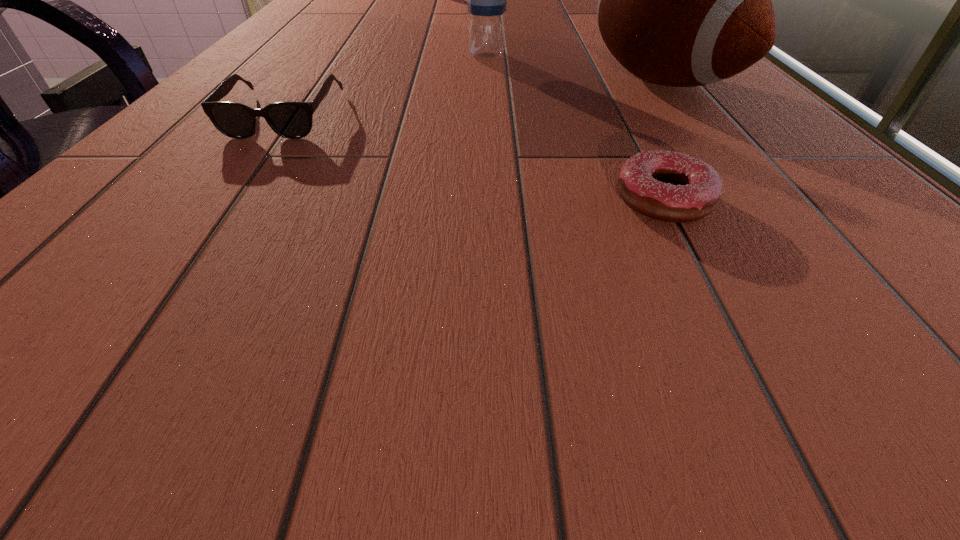
The width and height of the screenshot is (960, 540). In order to click on the third tallest object in this screenshot , I will do `click(293, 120)`.

Locate an element on the screen. The image size is (960, 540). sunglasses is located at coordinates tap(293, 120).

Where is `the shortest object`? This screenshot has width=960, height=540. the shortest object is located at coordinates (668, 186).

You are a GUI agent. You are given a task and a screenshot of the screen. Output one action in this format:
    pyautogui.click(x=<x>, y=<y>)
    Task: Click on the nearest object
    The height and width of the screenshot is (540, 960).
    Given the screenshot: What is the action you would take?
    pyautogui.click(x=668, y=186)

This screenshot has height=540, width=960. What are the coordinates of `the second object from left to right` in the screenshot? It's located at (487, 0).

What are the coordinates of `football` in the screenshot? It's located at (684, 0).

What are the coordinates of `free spot located at the front lenses of the leftmost object` in the screenshot? It's located at (253, 157).

Where is `vacant position located on the right of the shortest object`? Image resolution: width=960 pixels, height=540 pixels. vacant position located on the right of the shortest object is located at coordinates (817, 200).

I want to click on vacant space located 0.070m on the label of the third object from right to left, so click(x=490, y=76).

Where is `blank space located on the label of the third object from right to left`? blank space located on the label of the third object from right to left is located at coordinates (491, 84).